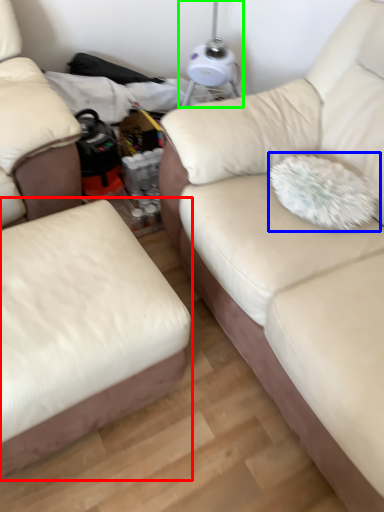
Question: Which object is positioned closest to studio couch (highlighted by a red box)? Select from throw pillow (highlighted by a blue box) and table lamp (highlighted by a green box).

Choices:
 (A) throw pillow
 (B) table lamp

Answer: (A)